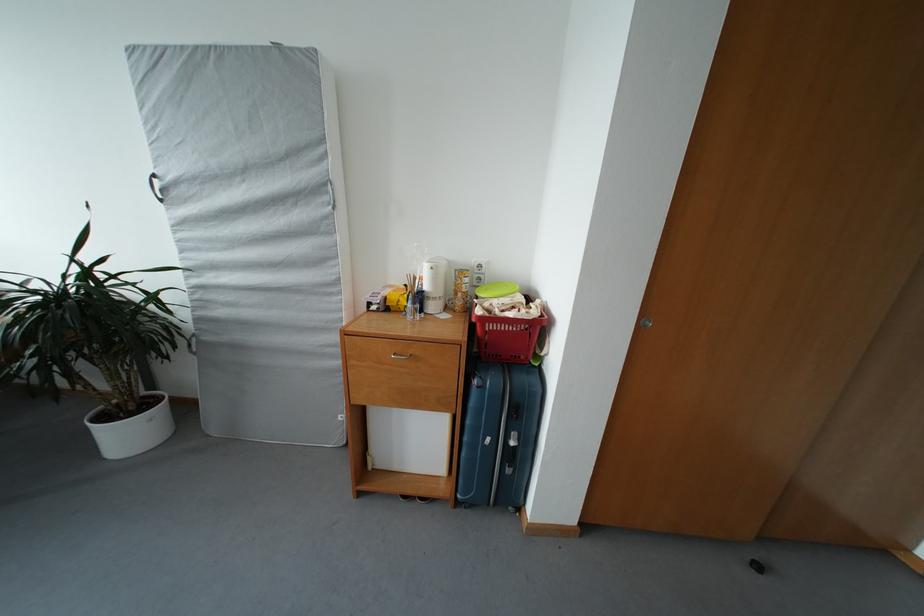
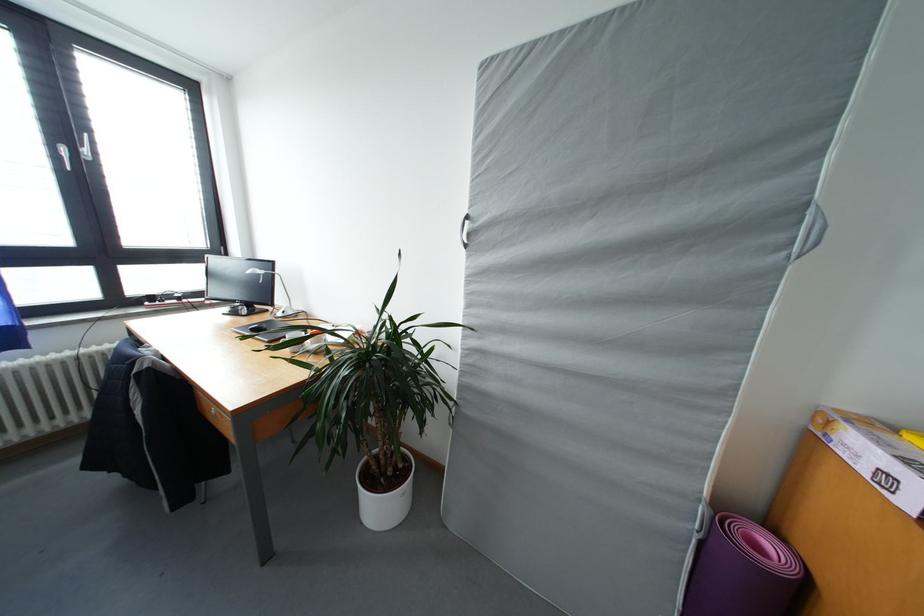
Question: The images are taken continuously from a first-person perspective. In which direction are you moving?

Choices:
 (A) Left
 (B) Right
 (C) Forward
 (D) Backward

Answer: (A)